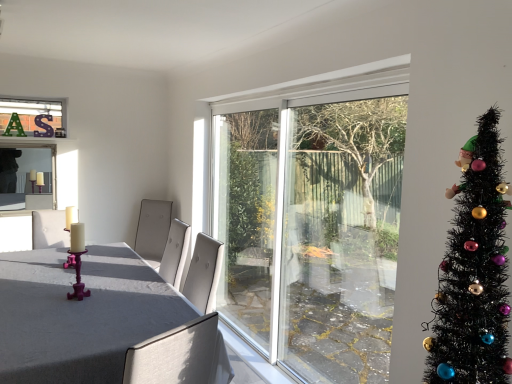
In order to click on free location to the right of white glossy candle at left in this screenshot , I will do `click(90, 270)`.